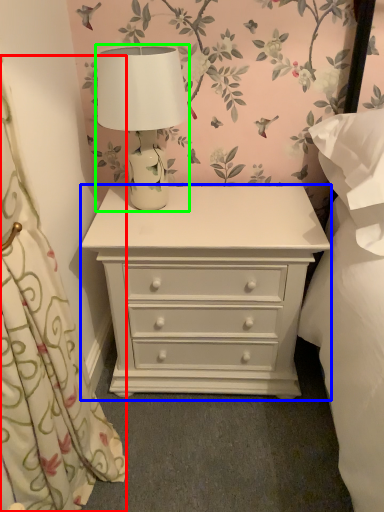
Question: Estimate the real-world distances between objects in this image. Which object is closer to curtain (highlighted by a red box), chest of drawers (highlighted by a blue box) or table lamp (highlighted by a green box)?

Choices:
 (A) chest of drawers
 (B) table lamp

Answer: (A)